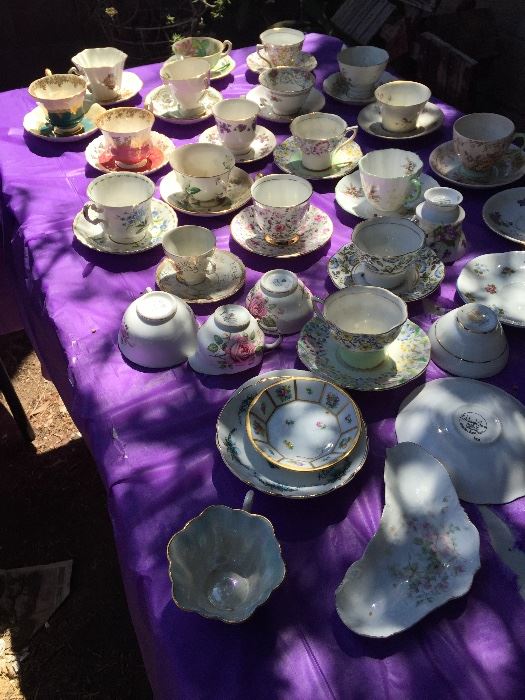
The image size is (525, 700). What are the coordinates of `teapot` in the screenshot? It's located at (445, 243).